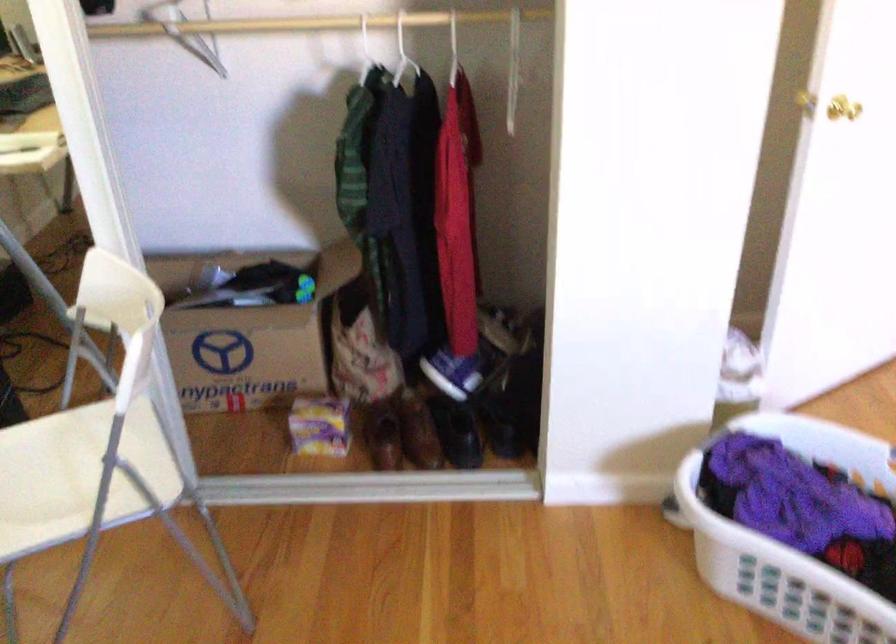
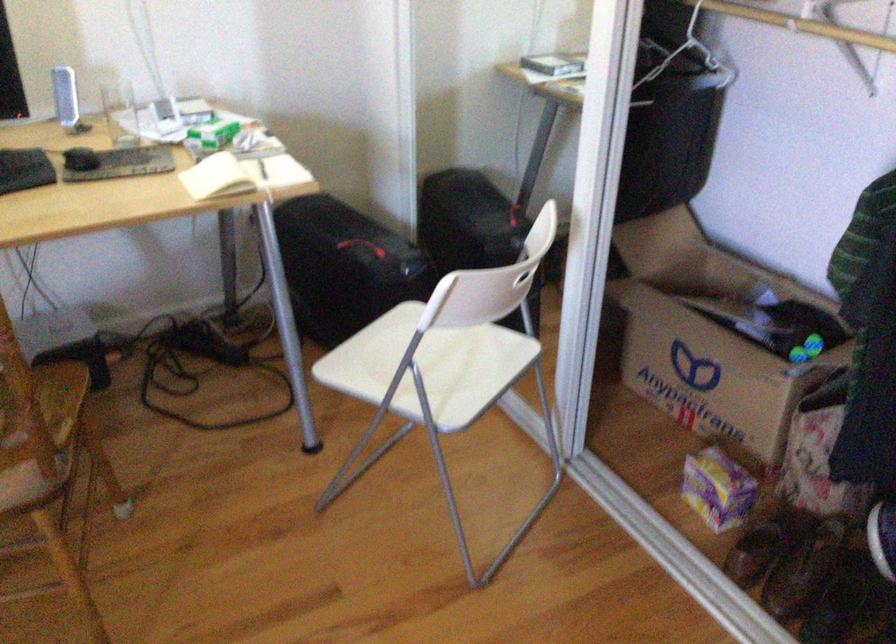
Find the pixel in the second image that matches (x=339, y=413) in the first image.

(718, 489)